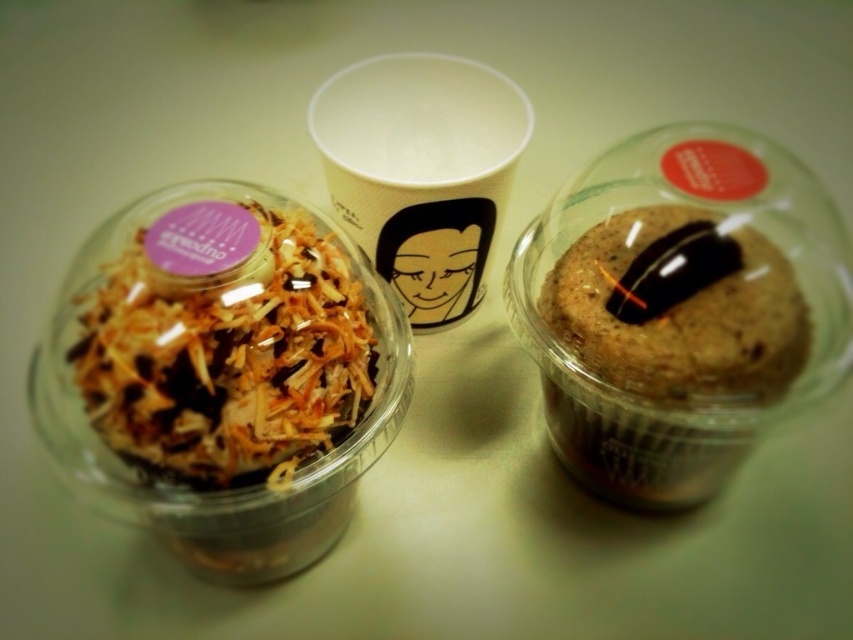
You are arranging items on a table and need to place a new item between the brown matte muffin at right and the white paper cup at center. Can you do that?

The brown matte muffin at right is to the right of the white paper cup at center, so there is space between them to place a new item.

Looking at this image, what are the coordinates of the brown matte muffin at right in the image?

The coordinates of the brown matte muffin at right are at point (665,358).

You are organizing items on a shelf and need to know which item takes up more space. Based on the scene, which item is smaller in size between the translucent plastic dessert at left and the white paper cup at center?

The translucent plastic dessert at left occupies less space than the white paper cup at center, so it is smaller in size.